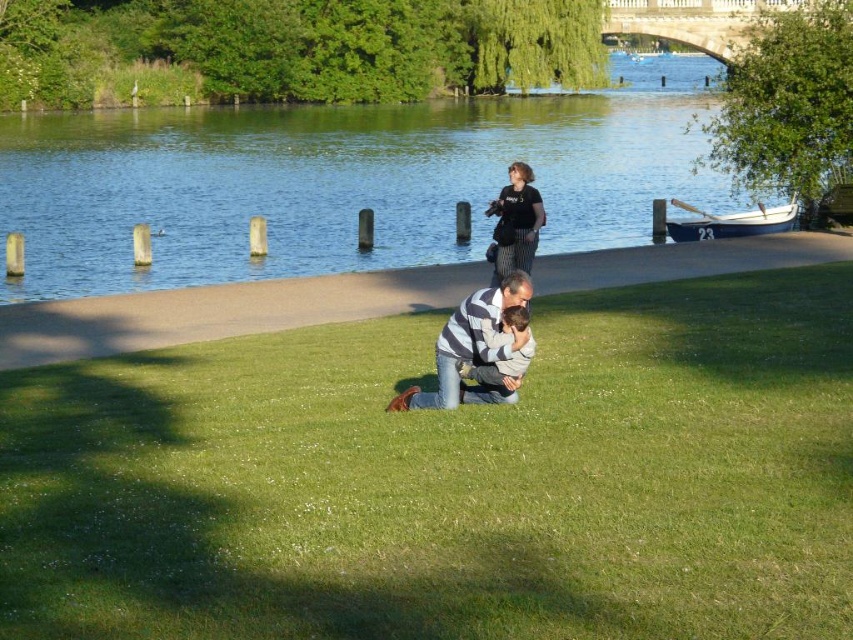
You are a photographer trying to capture the striped knit sweater at center and the striped fabric man at center in a single shot. Since both are striped, how can you ensure the sweater stands out more in the photo?

The striped knit sweater at center is positioned over striped fabric man at center, so adjusting the focus to highlight the sweater while slightly blurring the background could make it stand out more.

You are designing a new outfit for a character in an animated movie. The character will wear a striped knit sweater at center and a striped fabric man at center. Based on the scene description, which clothing item should you focus on first to ensure proper proportions?

The striped knit sweater at center might be wider than striped fabric man at center, so you should focus on the striped knit sweater at center first to ensure proper proportions.